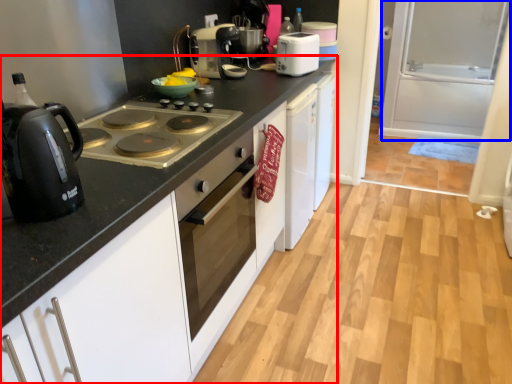
Question: Which point is closer to the camera, countertop (highlighted by a red box) or screen door (highlighted by a blue box)?

Choices:
 (A) countertop
 (B) screen door

Answer: (A)